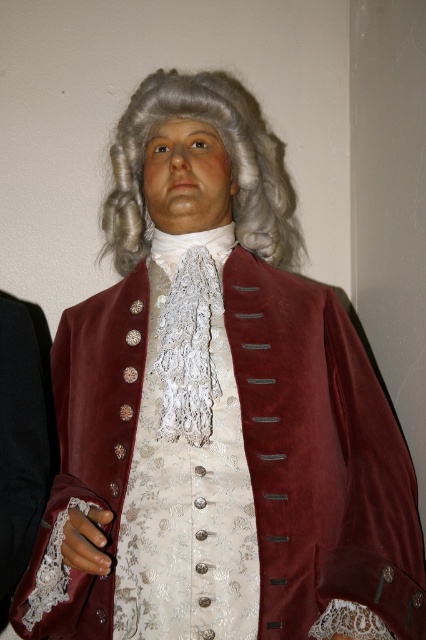
Who is higher up, white lace dress at center or grayhair at center?

grayhair at center is above.

In the scene shown: Which of these two, white lace dress at center or grayhair at center, stands taller?

Standing taller between the two is white lace dress at center.

Find the location of `white lace dress at center`. white lace dress at center is located at coordinates (187, 467).